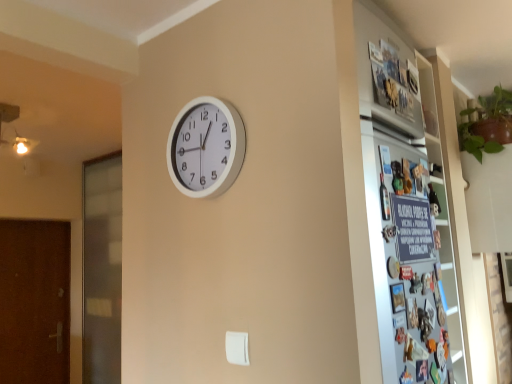
Question: Does metallic silver fridge at right come behind brown textured door at left, the 2th screen door in the right-to-left sequence?

Choices:
 (A) yes
 (B) no

Answer: (B)

Question: Is metallic silver fridge at right at the left side of brown textured door at left, the 2th screen door in the right-to-left sequence?

Choices:
 (A) yes
 (B) no

Answer: (B)

Question: From a real-world perspective, is metallic silver fridge at right over brown textured door at left, the 1th screen door when ordered from left to right?

Choices:
 (A) no
 (B) yes

Answer: (B)

Question: From a real-world perspective, is metallic silver fridge at right beneath brown textured door at left, the 2th screen door in the right-to-left sequence?

Choices:
 (A) no
 (B) yes

Answer: (A)

Question: Considering the relative sizes of metallic silver fridge at right and brown textured door at left, the 1th screen door when ordered from left to right, in the image provided, is metallic silver fridge at right taller than brown textured door at left, the 1th screen door when ordered from left to right,?

Choices:
 (A) no
 (B) yes

Answer: (A)

Question: In terms of height, does brown textured door at left, the 2th screen door in the right-to-left sequence, look taller or shorter compared to metallic silver fridge at right?

Choices:
 (A) short
 (B) tall

Answer: (B)

Question: From the image's perspective, is brown textured door at left, the 1th screen door when ordered from left to right, above or below metallic silver fridge at right?

Choices:
 (A) above
 (B) below

Answer: (B)

Question: In the image, is brown textured door at left, the 2th screen door in the right-to-left sequence, positioned in front of or behind metallic silver fridge at right?

Choices:
 (A) front
 (B) behind

Answer: (B)

Question: Is point (66, 365) positioned closer to the camera than point (404, 360)?

Choices:
 (A) farther
 (B) closer

Answer: (A)

Question: Considering their positions, is brown textured door at left, the 2th screen door in the right-to-left sequence, located in front of or behind transparent glass screen door at left, positioned as the 1th screen door in right-to-left order?

Choices:
 (A) front
 (B) behind

Answer: (B)

Question: Is brown textured door at left, the 2th screen door in the right-to-left sequence, taller or shorter than transparent glass screen door at left, positioned as the 1th screen door in right-to-left order?

Choices:
 (A) short
 (B) tall

Answer: (A)

Question: Is brown textured door at left, the 1th screen door when ordered from left to right, wider or thinner than transparent glass screen door at left, positioned as the 1th screen door in right-to-left order?

Choices:
 (A) thin
 (B) wide

Answer: (A)

Question: From a real-world perspective, is brown textured door at left, the 1th screen door when ordered from left to right, positioned above or below transparent glass screen door at left, positioned as the 1th screen door in right-to-left order?

Choices:
 (A) above
 (B) below

Answer: (B)

Question: Would you say white plastic wall clock at center is to the left or to the right of brown textured door at left, the 1th screen door when ordered from left to right, in the picture?

Choices:
 (A) left
 (B) right

Answer: (B)

Question: Considering their positions, is white plastic wall clock at center located in front of or behind brown textured door at left, the 2th screen door in the right-to-left sequence?

Choices:
 (A) behind
 (B) front

Answer: (B)